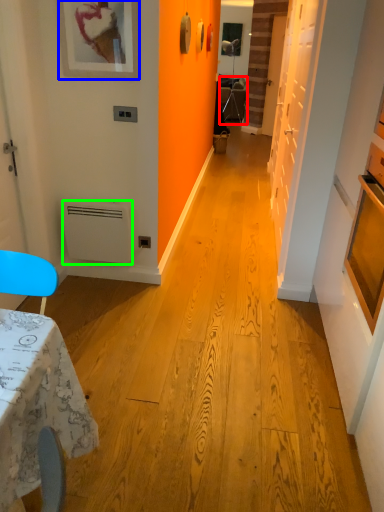
Question: Estimate the real-world distances between objects in this image. Which object is farther from armchair (highlighted by a red box), picture frame (highlighted by a blue box) or appliance (highlighted by a green box)?

Choices:
 (A) picture frame
 (B) appliance

Answer: (B)